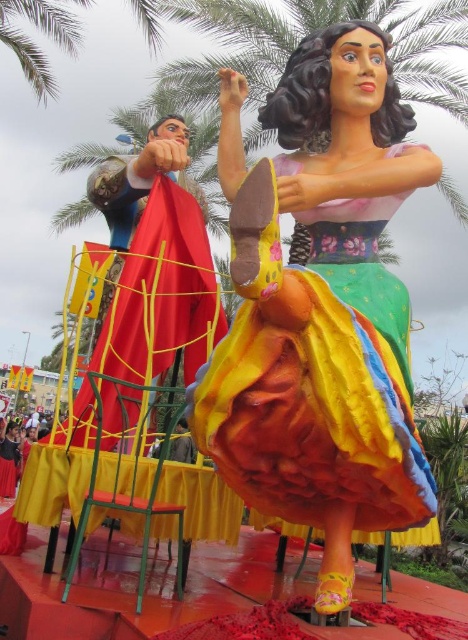
Is multicolored tulle skirt at center taller than metallic green chair at lower left?

Indeed, multicolored tulle skirt at center has a greater height compared to metallic green chair at lower left.

Is multicolored tulle skirt at center to the right of metallic green chair at lower left from the viewer's perspective?

Yes, multicolored tulle skirt at center is to the right of metallic green chair at lower left.

Identify the location of multicolored tulle skirt at center. (327, 374).

Locate an element on the screen. This screenshot has width=468, height=640. multicolored tulle skirt at center is located at coordinates (327, 374).